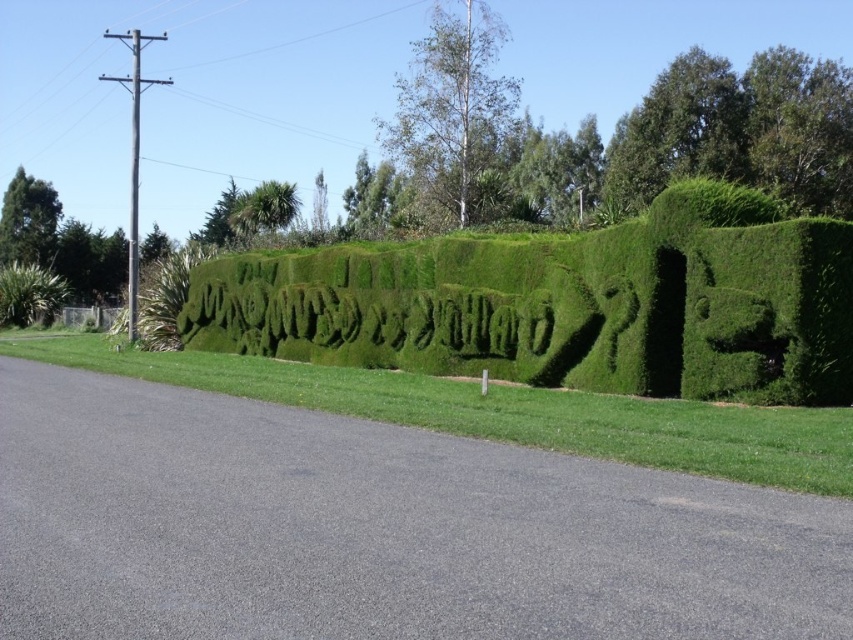
Question: Is green grass hedge at center further to the viewer compared to green hedge at center?

Choices:
 (A) yes
 (B) no

Answer: (A)

Question: Is green grass hedge at center smaller than green leafy shrub at left?

Choices:
 (A) yes
 (B) no

Answer: (B)

Question: Which object is the closest to the green hedge at center?

Choices:
 (A) green leafy shrub at left
 (B) green grass hedge at center

Answer: (B)

Question: Which of the following is the farthest from the observer?

Choices:
 (A) (1, 268)
 (B) (827, 422)

Answer: (A)

Question: Which object is positioned farthest from the green grass hedge at center?

Choices:
 (A) green hedge at center
 (B) green leafy shrub at left

Answer: (B)

Question: Observing the image, what is the correct spatial positioning of green grass hedge at center in reference to green leafy shrub at left?

Choices:
 (A) right
 (B) left

Answer: (A)